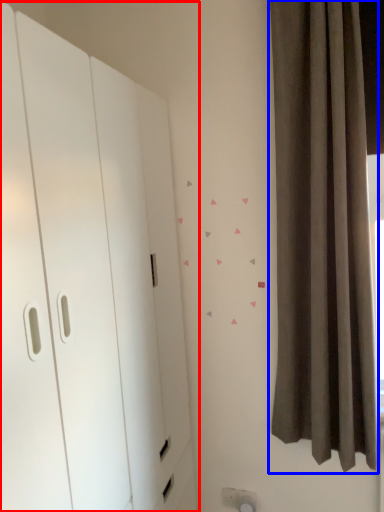
Question: Which point is further to the camera, dresser (highlighted by a red box) or curtain (highlighted by a blue box)?

Choices:
 (A) dresser
 (B) curtain

Answer: (B)